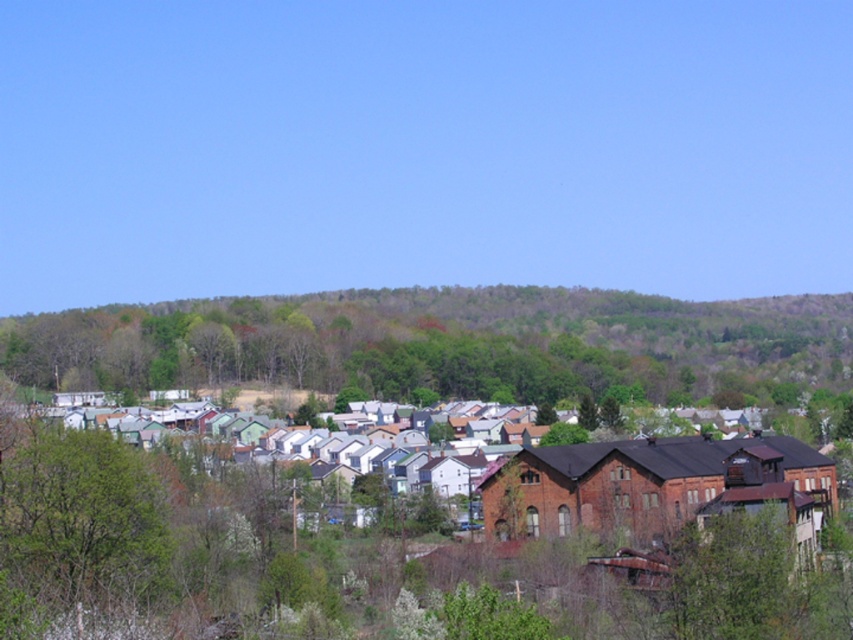
You are standing in the residential area and looking towards the green leafy hillside at upper center and the green leafy tree at lower left. Which of these two objects is higher in the image?

The green leafy hillside at upper center is positioned over the green leafy tree at lower left, so it is higher in the image.

You are a drone operator tasked with capturing aerial footage of the residential area. Your drone has a maximum flight range of 200 meters. If you are currently positioned above the green leafy tree at lower left and want to film the green leafy hillside at upper center, will your drone be able to reach it without exceeding its range?

The distance between the green leafy hillside at upper center and the green leafy tree at lower left is 191.91 meters. Since the drone has a maximum flight range of 200 meters, it can reach the green leafy hillside at upper center without exceeding its range.

You are standing in the residential area and want to determine which of the two points, point (786,330) or point (55,563), is closer to you. Based on the scene, which point is nearer?

Point (786,330) is closer to you because it is further to the viewer than point (55,563).